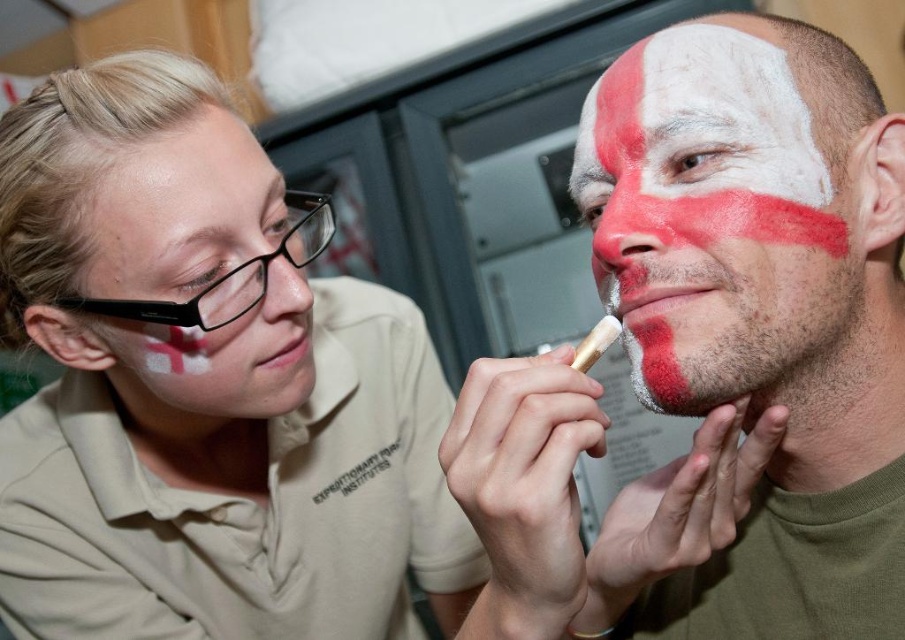
Question: Which object is positioned closest to the matte beige shirt at upper left?

Choices:
 (A) white matte face paint at center
 (B) matte gold paintbrush at lower center
 (C) matte white face paint at upper left
 (D) white matte paint at center

Answer: (C)

Question: Does white matte face paint at center have a lesser width compared to matte beige shirt at upper left?

Choices:
 (A) yes
 (B) no

Answer: (A)

Question: Considering the real-world distances, which object is closest to the matte white face paint at upper left?

Choices:
 (A) matte gold paintbrush at lower center
 (B) white matte face paint at center

Answer: (A)

Question: Is white matte face paint at center thinner than matte beige shirt at upper left?

Choices:
 (A) yes
 (B) no

Answer: (A)

Question: Which object appears closest to the camera in this image?

Choices:
 (A) white matte paint at center
 (B) matte gold paintbrush at lower center

Answer: (B)

Question: Can you confirm if matte beige shirt at upper left is smaller than matte white face paint at upper left?

Choices:
 (A) no
 (B) yes

Answer: (A)